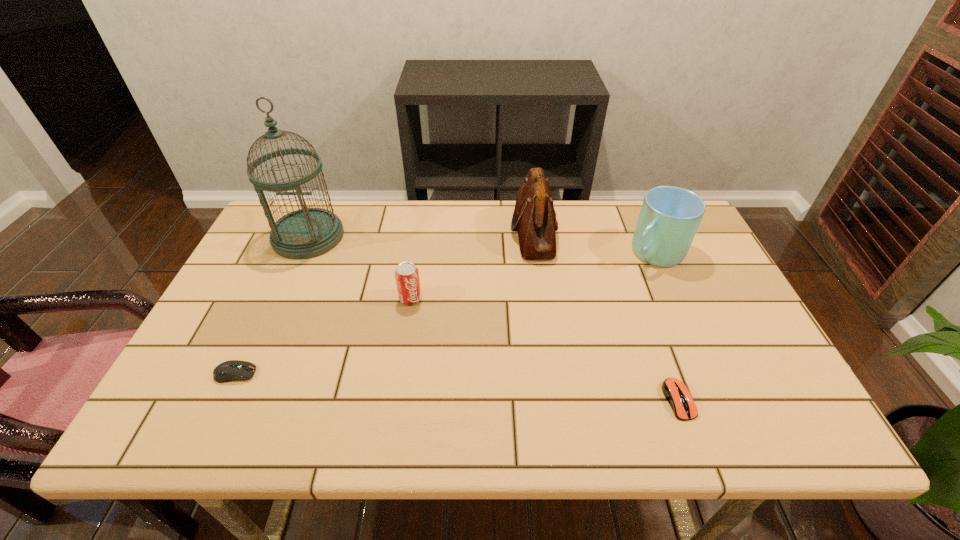
Where is `free space between the soda can and the left computer mouse`? Image resolution: width=960 pixels, height=540 pixels. free space between the soda can and the left computer mouse is located at coordinates (323, 336).

The height and width of the screenshot is (540, 960). I want to click on free space between the left computer mouse and the third shortest object, so tap(323, 336).

What are the coordinates of `free spot between the fourth object from left to right and the left computer mouse` in the screenshot? It's located at (384, 303).

Locate an element on the screen. The height and width of the screenshot is (540, 960). vacant area between the mug and the soda can is located at coordinates [x=532, y=275].

Locate an element on the screen. The image size is (960, 540). free area in between the third tallest object and the fifth shortest object is located at coordinates (594, 242).

The image size is (960, 540). What are the coordinates of `vacant point located between the left computer mouse and the birdcage` in the screenshot? It's located at (272, 305).

You are a GUI agent. You are given a task and a screenshot of the screen. Output one action in this format:
    pyautogui.click(x=<x>, y=<y>)
    Task: Click on the free point between the third object from left to right and the shortest object
    This screenshot has height=540, width=960.
    Given the screenshot: What is the action you would take?
    (544, 349)

You are a GUI agent. You are given a task and a screenshot of the screen. Output one action in this format:
    pyautogui.click(x=<x>, y=<y>)
    Task: Click on the vacant space in between the fourth shortest object and the left computer mouse
    This screenshot has width=960, height=540.
    Given the screenshot: What is the action you would take?
    pyautogui.click(x=444, y=313)

The height and width of the screenshot is (540, 960). In order to click on free space that is in between the fourth object from right to left and the third tallest object in this screenshot , I will do `click(532, 275)`.

Identify which object is located as the nearest to the shortest object. Please provide its 2D coordinates. Your answer should be formatted as a tuple, i.e. [(x, y)], where the tuple contains the x and y coordinates of a point satisfying the conditions above.

[(670, 216)]